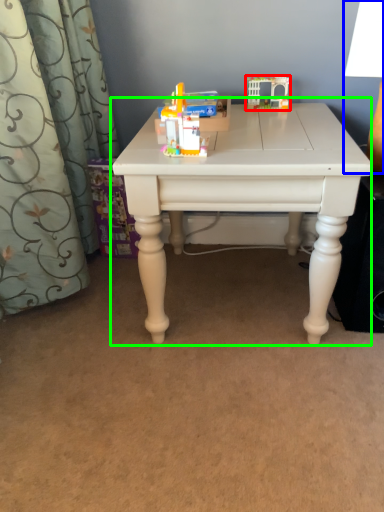
Question: Estimate the real-world distances between objects in this image. Which object is closer to toy (highlighted by a red box), table lamp (highlighted by a blue box) or table (highlighted by a green box)?

Choices:
 (A) table lamp
 (B) table

Answer: (A)